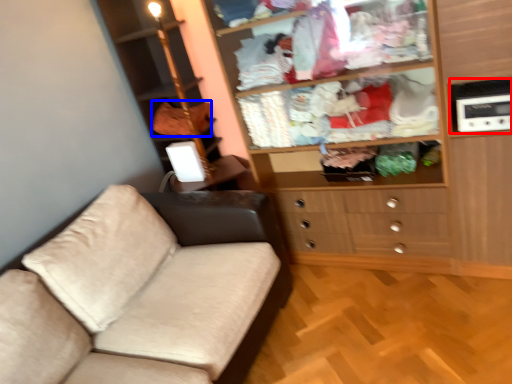
Question: Among these objects, which one is farthest to the camera, appliance (highlighted by a red box) or clothing (highlighted by a blue box)?

Choices:
 (A) appliance
 (B) clothing

Answer: (B)